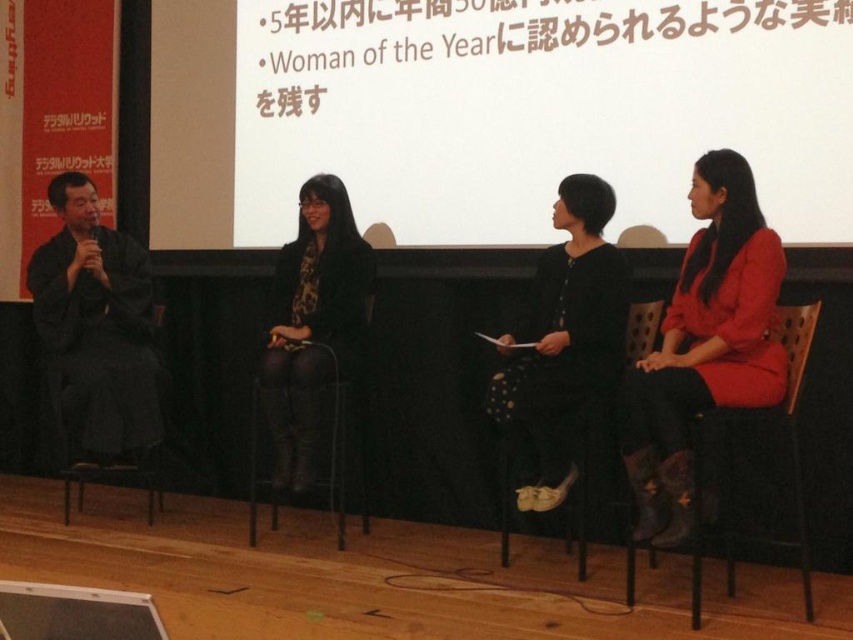
Question: Does dark fabric chair at left have a lesser width compared to black fabric chair at center?

Choices:
 (A) yes
 (B) no

Answer: (B)

Question: Does silk kimono at left have a lesser width compared to black fabric chair at center?

Choices:
 (A) no
 (B) yes

Answer: (A)

Question: Can you confirm if white matte projection screen at upper center is positioned above black metal chair at center?

Choices:
 (A) yes
 (B) no

Answer: (A)

Question: Which point is closer to the camera?

Choices:
 (A) (140, 353)
 (B) (779, 417)

Answer: (B)

Question: Among these objects, which one is nearest to the camera?

Choices:
 (A) dark fabric chair at left
 (B) black dotted dress at center

Answer: (B)

Question: Which point appears farthest from the camera in this image?

Choices:
 (A) (639, 384)
 (B) (364, 451)
 (C) (503, 506)
 (D) (721, 540)

Answer: (B)